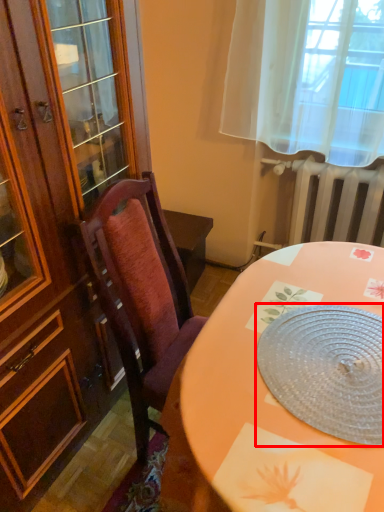
Question: From the image's perspective, where is platter (annotated by the red box) located in relation to radiator in the image?

Choices:
 (A) above
 (B) below

Answer: (B)